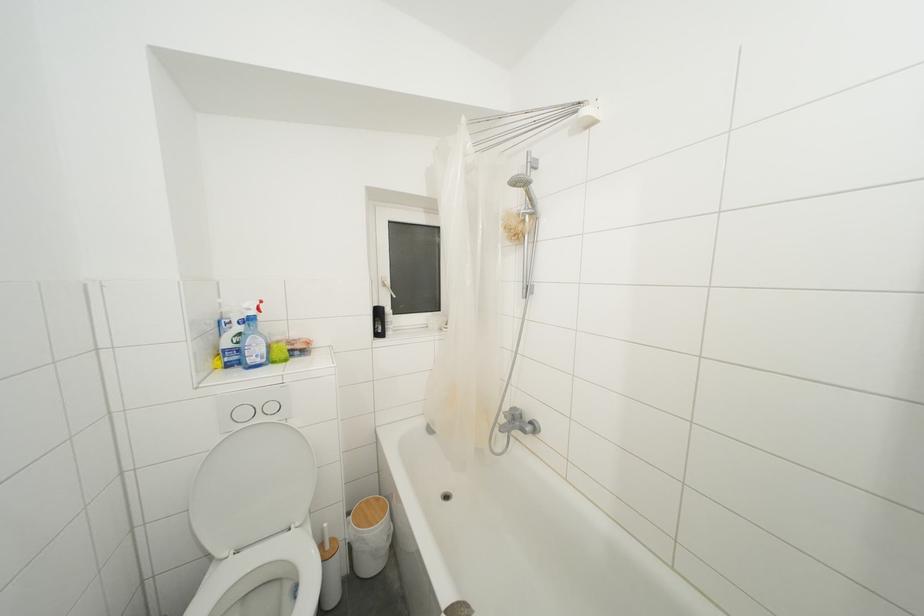
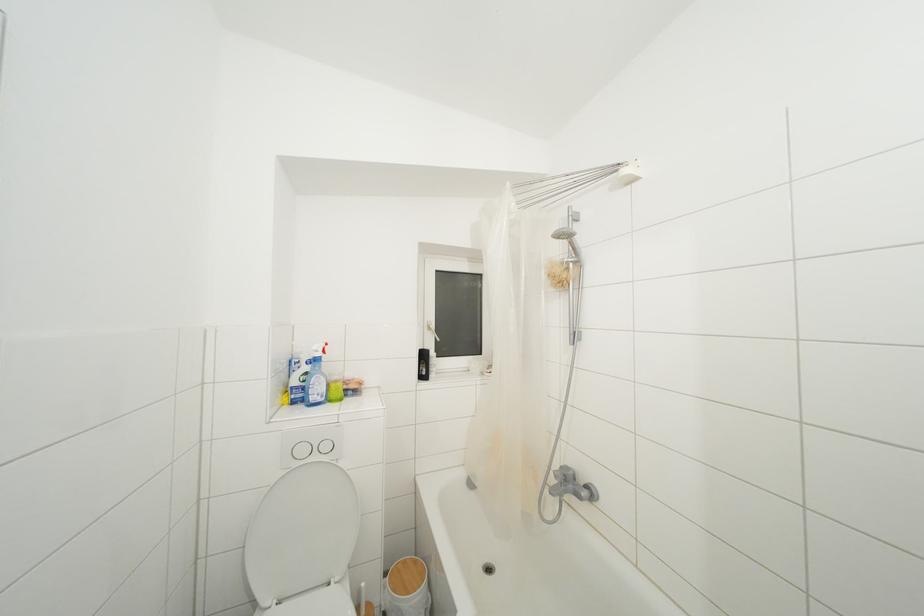
Locate, in the second image, the point that corresponds to [263,424] in the first image.

(320, 463)